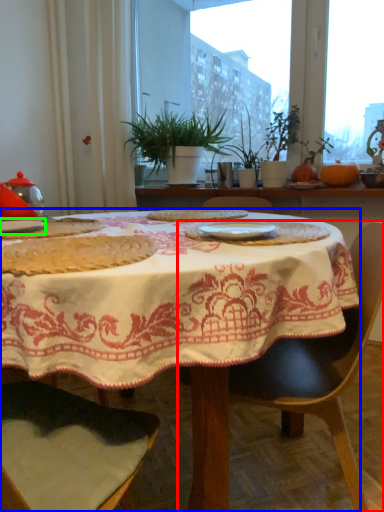
Question: Which object is the closest to the chair (highlighted by a red box)? Choose among these: table (highlighted by a blue box) or tableware (highlighted by a green box).

Choices:
 (A) table
 (B) tableware

Answer: (A)